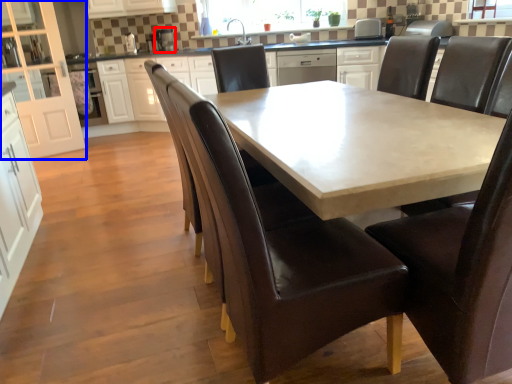
Question: Among these objects, which one is farthest to the camera, appliance (highlighted by a red box) or cabinetry (highlighted by a blue box)?

Choices:
 (A) appliance
 (B) cabinetry

Answer: (A)